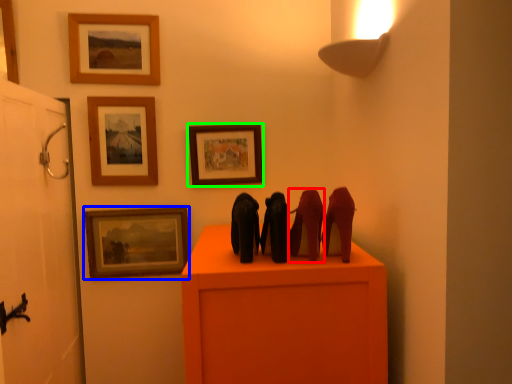
Question: Estimate the real-world distances between objects in this image. Which object is farther from animal (highlighted by a red box), picture frame (highlighted by a blue box) or picture frame (highlighted by a green box)?

Choices:
 (A) picture frame
 (B) picture frame

Answer: (A)